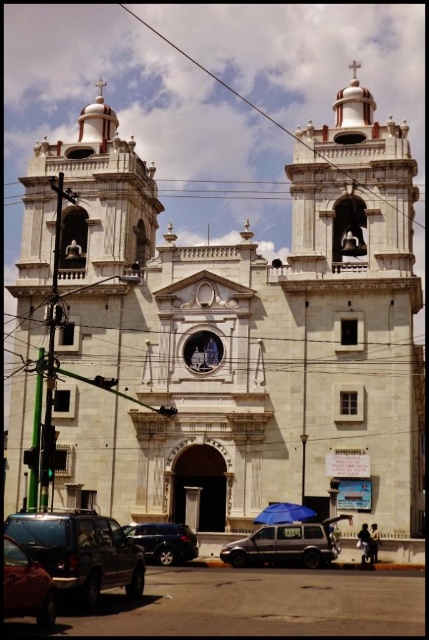
Question: Can you confirm if metallic gray suv at lower left is smaller than matte black van at center?

Choices:
 (A) no
 (B) yes

Answer: (A)

Question: Which of the following is the closest to the observer?

Choices:
 (A) (163, 557)
 (B) (293, 541)
 (C) (18, 524)
 (D) (53, 611)

Answer: (D)

Question: Which point appears closest to the camera in this image?

Choices:
 (A) (x=14, y=602)
 (B) (x=171, y=561)

Answer: (A)

Question: Which is farther from the matte black van at center?

Choices:
 (A) satin black car at lower left
 (B) metallic gray suv at lower left
 (C) shiny black car at lower left

Answer: (C)

Question: Is matte black van at center bigger than shiny black car at lower left?

Choices:
 (A) no
 (B) yes

Answer: (A)

Question: Is matte black van at center positioned in front of satin black car at lower left?

Choices:
 (A) no
 (B) yes

Answer: (B)